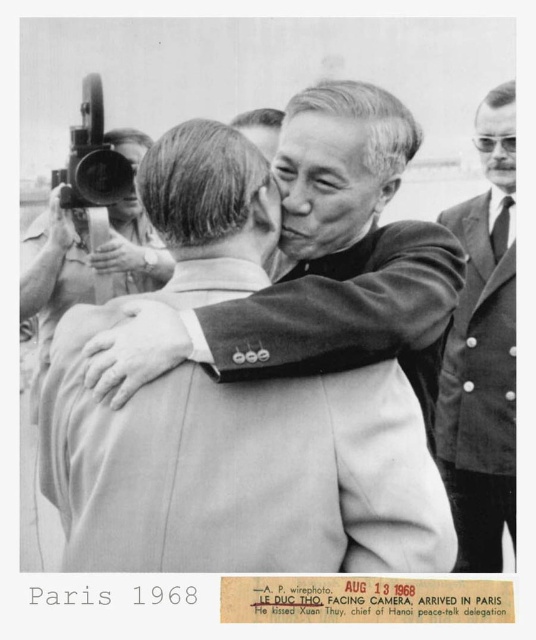
What do you see at coordinates (329, 260) in the screenshot? I see `smooth suit at center` at bounding box center [329, 260].

This screenshot has width=536, height=640. Identify the location of smooth suit at center. (329, 260).

Where is `smooth suit at center`? The height and width of the screenshot is (640, 536). smooth suit at center is located at coordinates (329, 260).